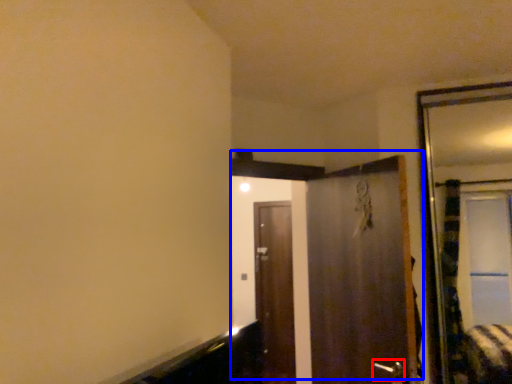
Question: Among these objects, which one is farthest to the camera, door handle (highlighted by a red box) or door (highlighted by a blue box)?

Choices:
 (A) door handle
 (B) door

Answer: (B)